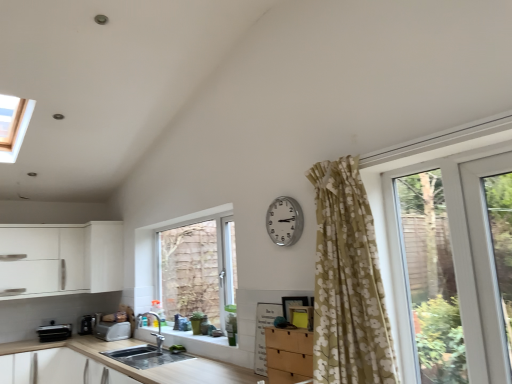
Identify the location of free location above smooth concrete sink at lower center (from a real-world perspective). (196, 334).